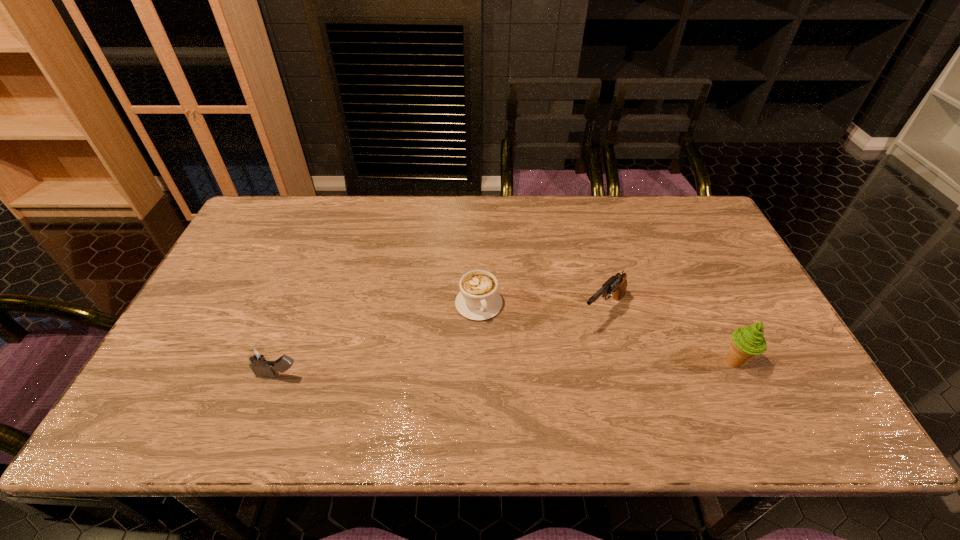
The image size is (960, 540). I want to click on igniter, so click(259, 362).

Locate an element on the screen. This screenshot has width=960, height=540. icecream is located at coordinates (746, 342).

Identify the location of the tallest object. This screenshot has width=960, height=540. (746, 342).

The width and height of the screenshot is (960, 540). I want to click on gun, so click(x=617, y=284).

The width and height of the screenshot is (960, 540). Find the location of `the shortest object`. the shortest object is located at coordinates (478, 299).

At what (x,y) coordinates should I click in order to perform the action: click on cappuccino. Please return your answer as a coordinate pair (x, y). This screenshot has width=960, height=540. Looking at the image, I should click on (478, 299).

You are a GUI agent. You are given a task and a screenshot of the screen. Output one action in this format:
    pyautogui.click(x=<x>, y=<y>)
    Task: Click on the vacant space located on the back of the igniter
    This screenshot has height=540, width=960.
    Given the screenshot: What is the action you would take?
    pyautogui.click(x=322, y=260)

This screenshot has width=960, height=540. In order to click on free region located 0.130m on the back of the rightmost object in this screenshot , I will do `click(708, 309)`.

Where is `vacant space located 0.090m along the barrel of the third object from left to right`? vacant space located 0.090m along the barrel of the third object from left to right is located at coordinates (566, 346).

What are the coordinates of `blank space located 0.100m along the barrel of the third object from left to right` in the screenshot? It's located at (564, 348).